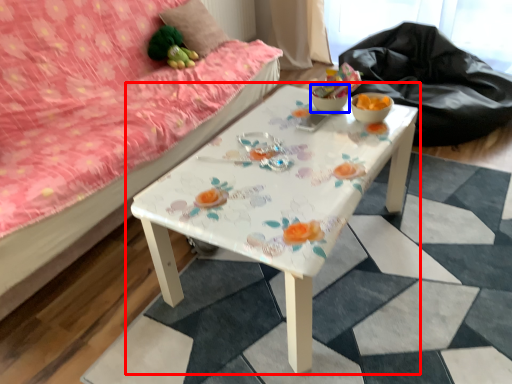
Question: Which point is closer to the camera, table (highlighted by a red box) or glass bowl (highlighted by a blue box)?

Choices:
 (A) table
 (B) glass bowl

Answer: (A)